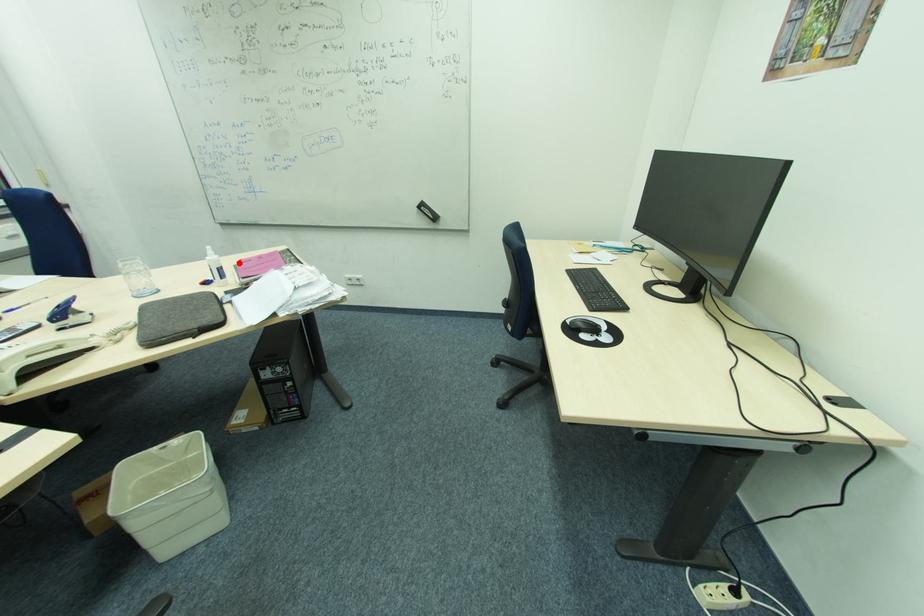
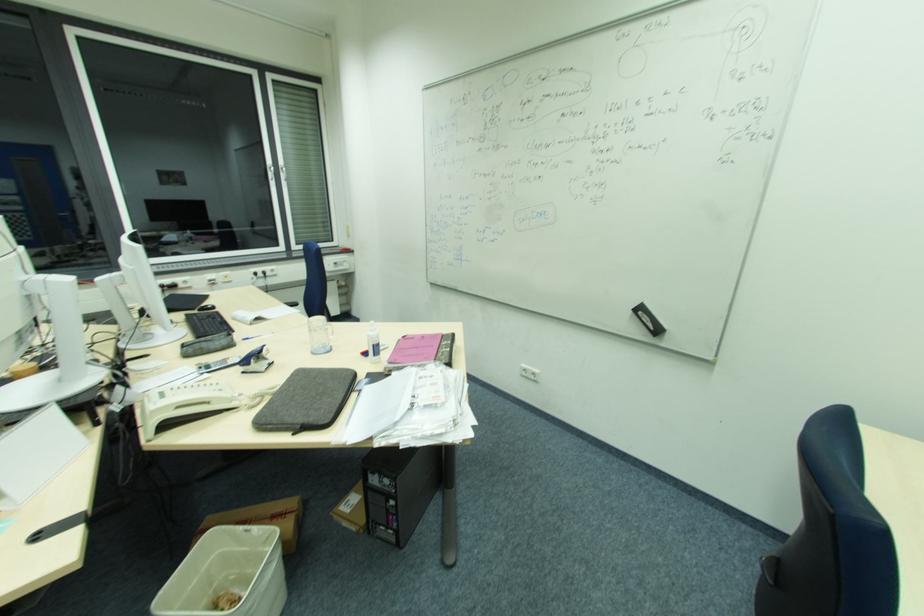
Where in the second image is the point corresponding to the highlighted location from the first image?

(403, 338)